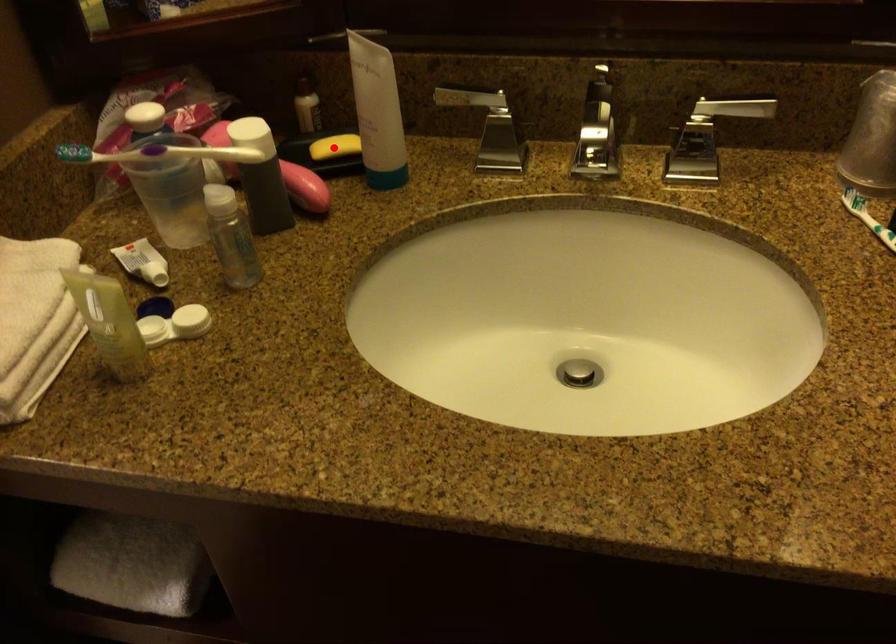
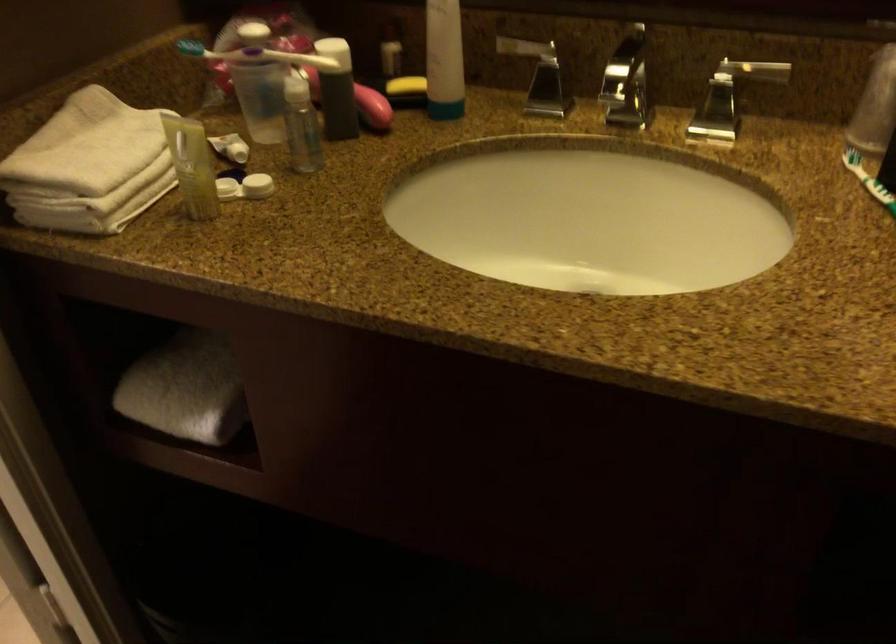
Question: I am providing you with two images of the same scene from different viewpoints. A red point is shown in image1. For the corresponding object point in image2, is it positioned nearer or farther from the camera?

Choices:
 (A) Nearer
 (B) Farther

Answer: (B)